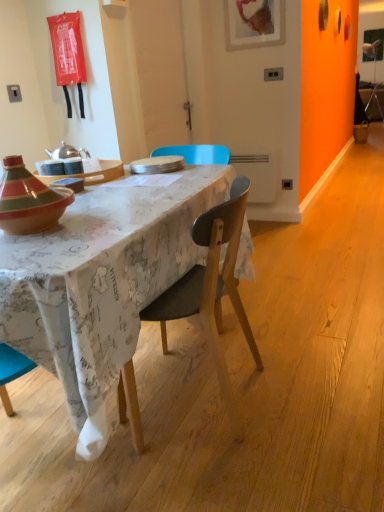
Question: Considering the positions of maple wood desk at center and wooden chair at center in the image, is maple wood desk at center wider or thinner than wooden chair at center?

Choices:
 (A) thin
 (B) wide

Answer: (B)

Question: Would you say maple wood desk at center is inside or outside wooden chair at center?

Choices:
 (A) inside
 (B) outside

Answer: (B)

Question: Considering the real-world distances, which object is farthest from the maple wood desk at center?

Choices:
 (A) wooden chair at center
 (B) white matte plate at center
 (C) matte wooden tray at center

Answer: (B)

Question: Estimate the real-world distances between objects in this image. Which object is farther from the wooden chair at center?

Choices:
 (A) white matte plate at center
 (B) maple wood desk at center
 (C) matte wooden tray at center

Answer: (C)